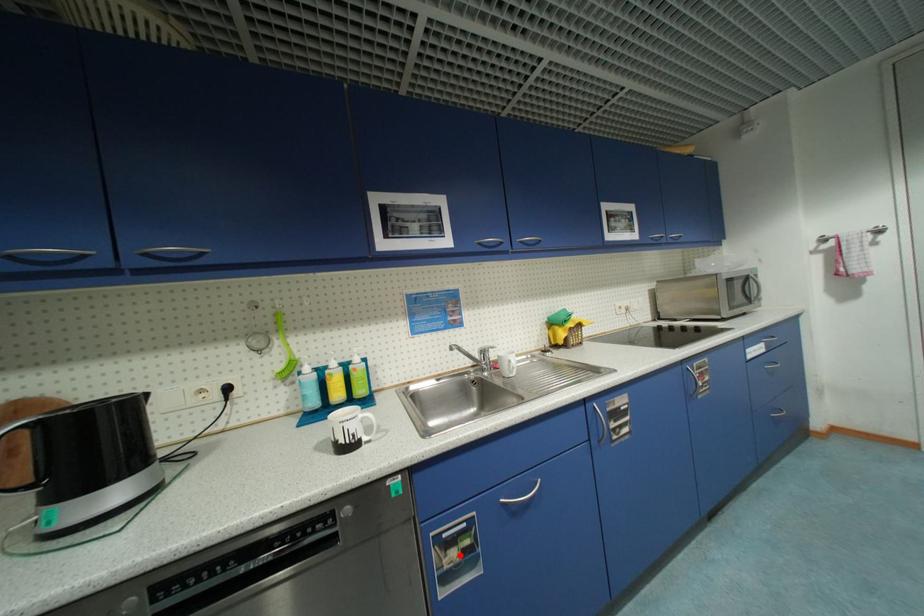
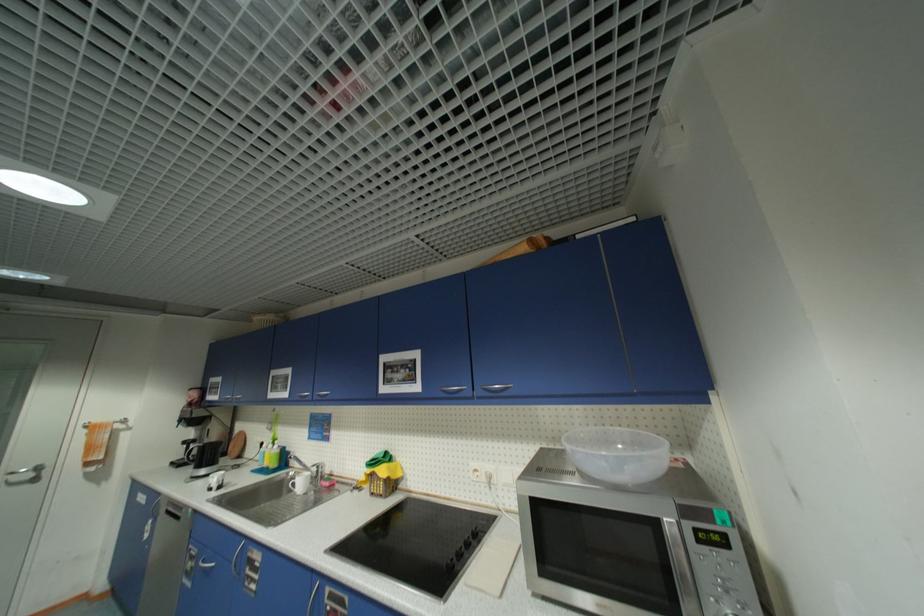
Question: I am providing you with two images of the same scene from different viewpoints. In image1, a red point is highlighted. Considering the same 3D point in image2, which of the following is correct?

Choices:
 (A) It is closer
 (B) It is farther

Answer: (A)